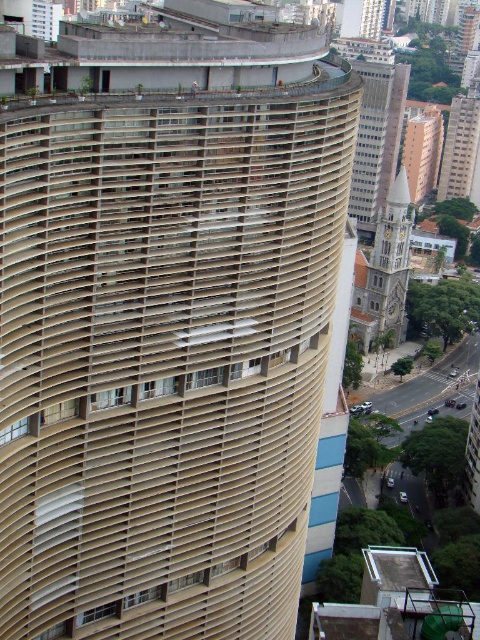
You are a city planner reviewing this area and need to assess visibility between landmarks. If you are standing at the base of the white stone tower at right, can you see the beige concrete tower at upper right without any obstructions?

Yes, the white stone tower at right is in front of the beige concrete tower at upper right, meaning the beige concrete tower at upper right is behind it. However, since the white stone tower at right is positioned in front, it may block the view. Wait, there is a contradiction here. Let me think again. The description says the white stone tower is in front of the beige one, so the beige is behind. Therefore, if you are at the base of the white tower, you might not see the beige one because it is behind the

You are an architect analyzing the urban skyline. You notice the beige textured tower at upper right and the white stone tower at right. Which of these two towers has a greater height?

The beige textured tower at upper right is much taller than the white stone tower at right, making it the taller of the two.